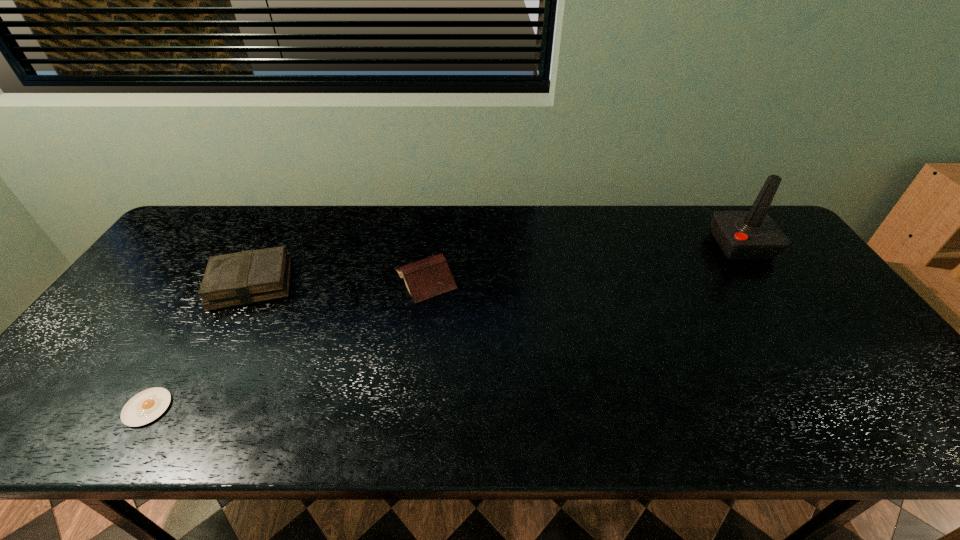
You are a GUI agent. You are given a task and a screenshot of the screen. Output one action in this format:
    pyautogui.click(x=<x>, y=<y>)
    Task: Click on the object present at the far edge
    This screenshot has width=960, height=540.
    Given the screenshot: What is the action you would take?
    pyautogui.click(x=742, y=235)

At what (x,y) coordinates should I click in order to perform the action: click on object at the near edge. Please return your answer as a coordinate pair (x, y). This screenshot has width=960, height=540. Looking at the image, I should click on (146, 406).

Locate an element on the screen. The width and height of the screenshot is (960, 540). object present at the right edge is located at coordinates (742, 235).

At what (x,y) coordinates should I click in order to perform the action: click on object at the far right corner. Please return your answer as a coordinate pair (x, y). The image size is (960, 540). Looking at the image, I should click on (742, 235).

Find the location of a particular element. free space at the far edge of the desktop is located at coordinates (533, 228).

In the image, there is a desktop. Where is `blank space at the near edge`? Image resolution: width=960 pixels, height=540 pixels. blank space at the near edge is located at coordinates (448, 417).

Where is `free point at the right edge`? free point at the right edge is located at coordinates pyautogui.click(x=902, y=399).

Locate an element on the screen. The width and height of the screenshot is (960, 540). vacant space at the far left corner of the desktop is located at coordinates (226, 220).

You are a GUI agent. You are given a task and a screenshot of the screen. Output one action in this format:
    pyautogui.click(x=<x>, y=<y>)
    Task: Click on the vacant space at the near left corner of the desktop
    
    Given the screenshot: What is the action you would take?
    pyautogui.click(x=76, y=419)

Find the location of `vacant space that is in between the joystick and the left book`. vacant space that is in between the joystick and the left book is located at coordinates (496, 264).